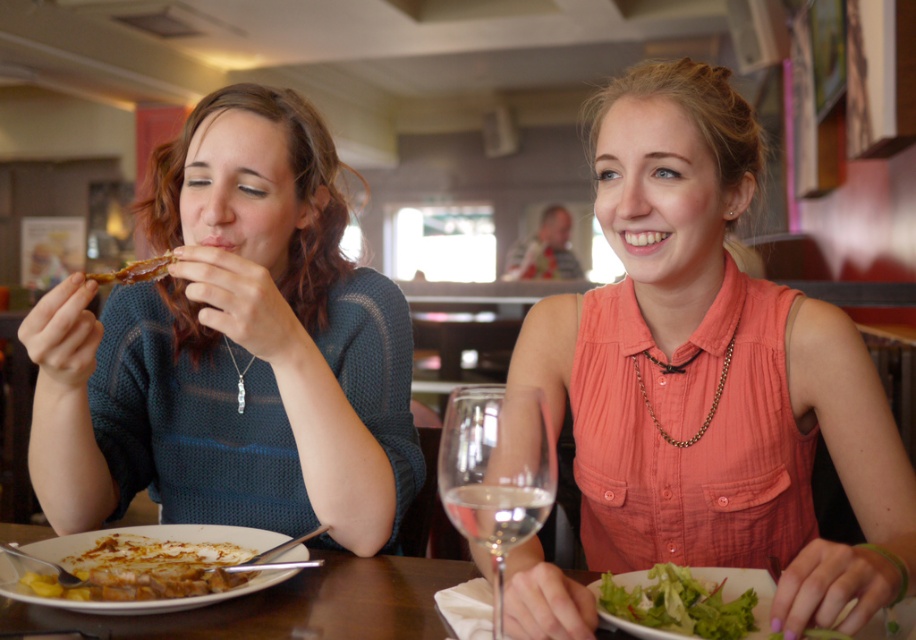
Does point (657, 417) come behind point (689, 592)?

Yes, point (657, 417) is behind point (689, 592).

The image size is (916, 640). I want to click on orange fabric shirt at center, so click(713, 372).

Between point (718, 225) and point (702, 612), which one is positioned behind?

Positioned behind is point (718, 225).

The height and width of the screenshot is (640, 916). In order to click on orange fabric shirt at center in this screenshot , I will do `click(713, 372)`.

At what (x,y) coordinates should I click in order to perform the action: click on knitted blue sweater at left. Please return your answer as a coordinate pair (x, y). Looking at the image, I should click on (232, 348).

Can you confirm if knitted blue sweater at left is positioned to the left of green leafy salad at lower right?

Indeed, knitted blue sweater at left is positioned on the left side of green leafy salad at lower right.

At what (x,y) coordinates should I click in order to perform the action: click on knitted blue sweater at left. Please return your answer as a coordinate pair (x, y). Looking at the image, I should click on (232, 348).

This screenshot has height=640, width=916. Identify the location of knitted blue sweater at left. (232, 348).

At what (x,y) coordinates should I click in order to perform the action: click on orange fabric shirt at center. Please return your answer as a coordinate pair (x, y). The width and height of the screenshot is (916, 640). Looking at the image, I should click on (713, 372).

Does orange fabric shirt at center appear on the left side of golden fried chicken at lower left?

No, orange fabric shirt at center is not to the left of golden fried chicken at lower left.

What do you see at coordinates (713, 372) in the screenshot?
I see `orange fabric shirt at center` at bounding box center [713, 372].

Where is `orange fabric shirt at center`? The width and height of the screenshot is (916, 640). orange fabric shirt at center is located at coordinates coord(713,372).